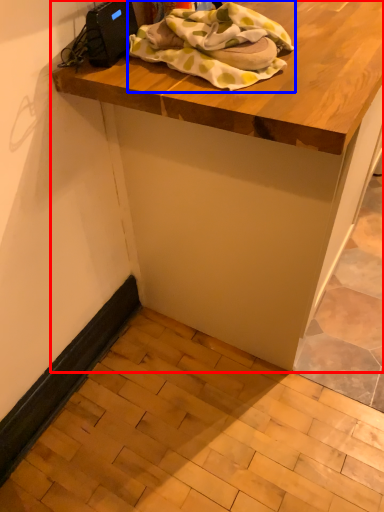
Question: Which object appears farthest to the camera in this image, table (highlighted by a red box) or blanket (highlighted by a blue box)?

Choices:
 (A) table
 (B) blanket

Answer: (B)